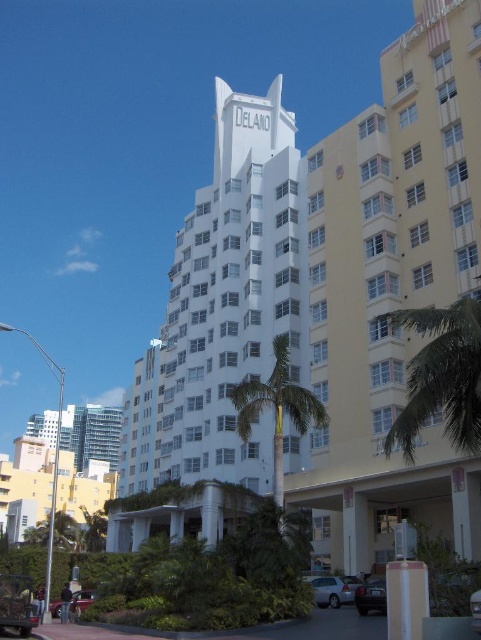
Locate an element on the screen. silver metallic sedan at lower center is located at coordinates 331,589.

Can you confirm if silver metallic sedan at lower center is bigger than metallic silver car at lower right?

Indeed, silver metallic sedan at lower center has a larger size compared to metallic silver car at lower right.

Which is in front, point (352, 593) or point (371, 589)?

Point (371, 589)

This screenshot has height=640, width=481. In order to click on silver metallic sedan at lower center in this screenshot , I will do `click(331, 589)`.

Is white smooth building at center below green leafy palm tree at center?

Incorrect, white smooth building at center is not positioned below green leafy palm tree at center.

The image size is (481, 640). What do you see at coordinates (326, 298) in the screenshot? I see `white smooth building at center` at bounding box center [326, 298].

Where is `white smooth building at center`? The image size is (481, 640). white smooth building at center is located at coordinates (326, 298).

Can you confirm if metallic silver car at lower right is positioned above metallic silver car at lower left?

Yes.

Is metallic silver car at lower right wider than metallic silver car at lower left?

Incorrect, metallic silver car at lower right's width does not surpass metallic silver car at lower left's.

Is point (364, 611) farther from camera compared to point (77, 593)?

That is False.

In order to click on metallic silver car at lower right in this screenshot , I will do `click(370, 596)`.